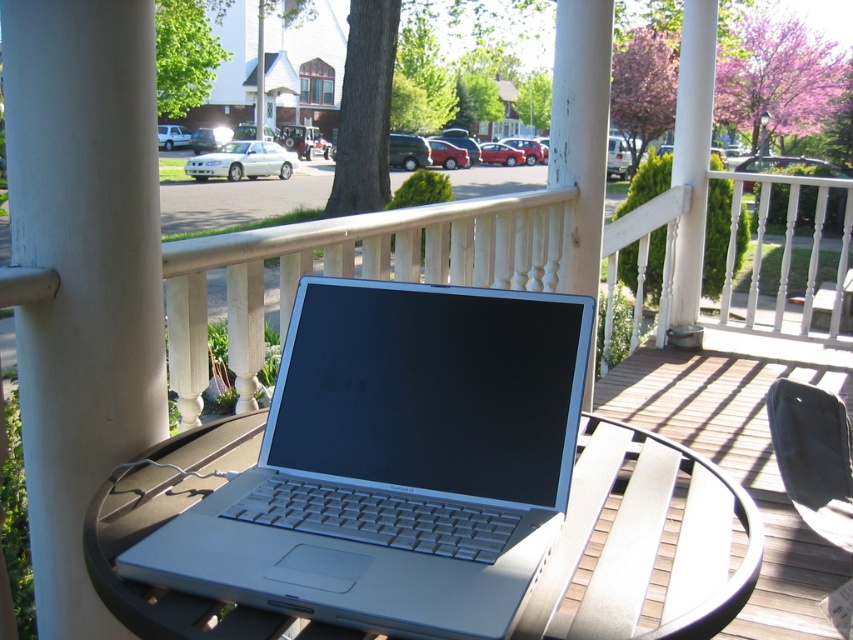
You are standing on the porch and want to reach both the point at coordinates [224,572] and the point at coordinates [39,499]. Which point will you reach first?

You will reach the point at coordinates [224,572] first because it is closer to you than the point at coordinates [39,499].

You are a painter who needs to apply a fresh coat of paint to both the white painted wood at center and the brown wooden deck at center. Based on the scene, which object requires more paint due to its larger surface area?

The brown wooden deck at center requires more paint because it has a greater width than the white painted wood at center, meaning it has a larger surface area.

You are standing on the brown wooden deck at center and want to place a small potted plant on the white painted wood at center. Can you reach it without moving your feet?

The white painted wood at center is closer to the viewer than brown wooden deck at center, so yes, you can reach it without moving your feet since it is nearer to your current position.